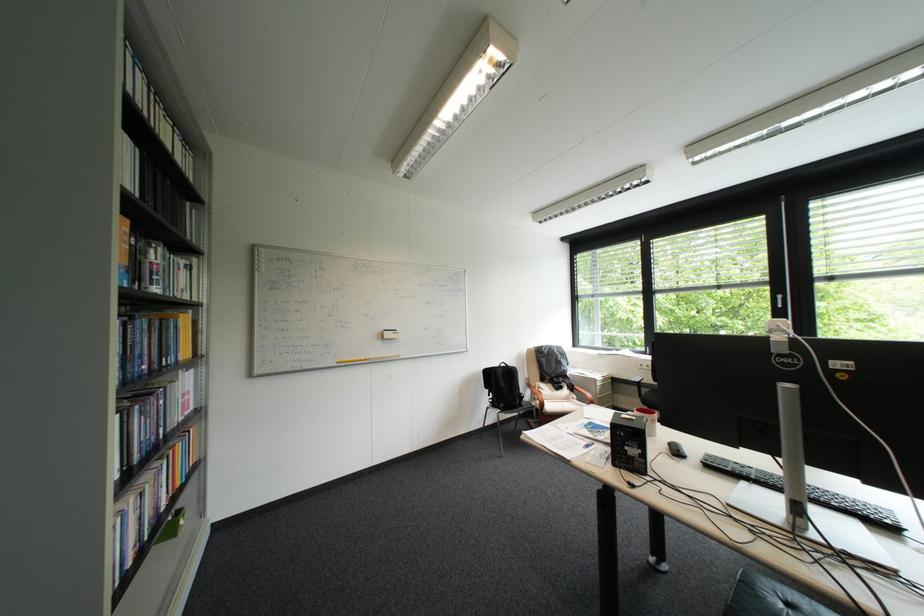
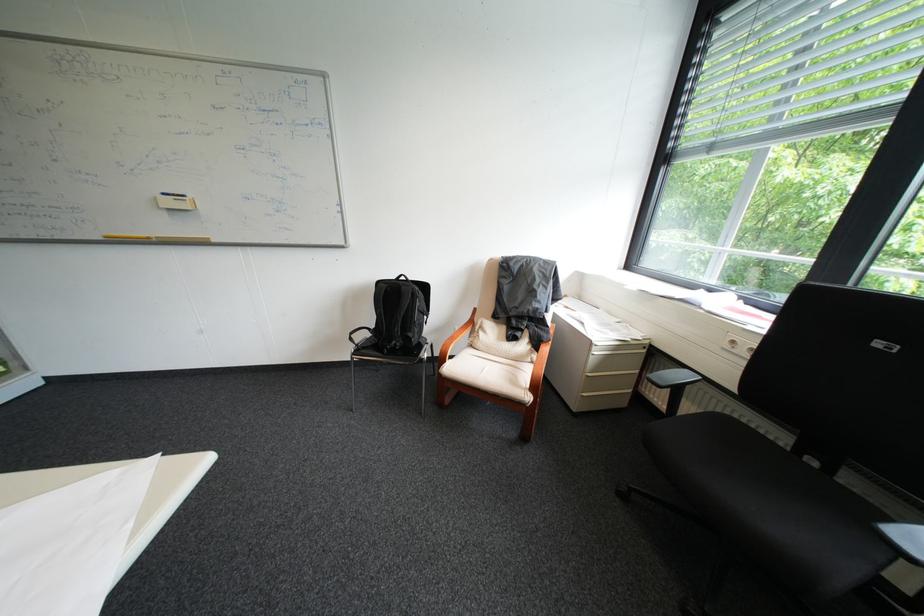
Where in the second image is the point corresponding to (611,385) from the first image?

(609, 353)